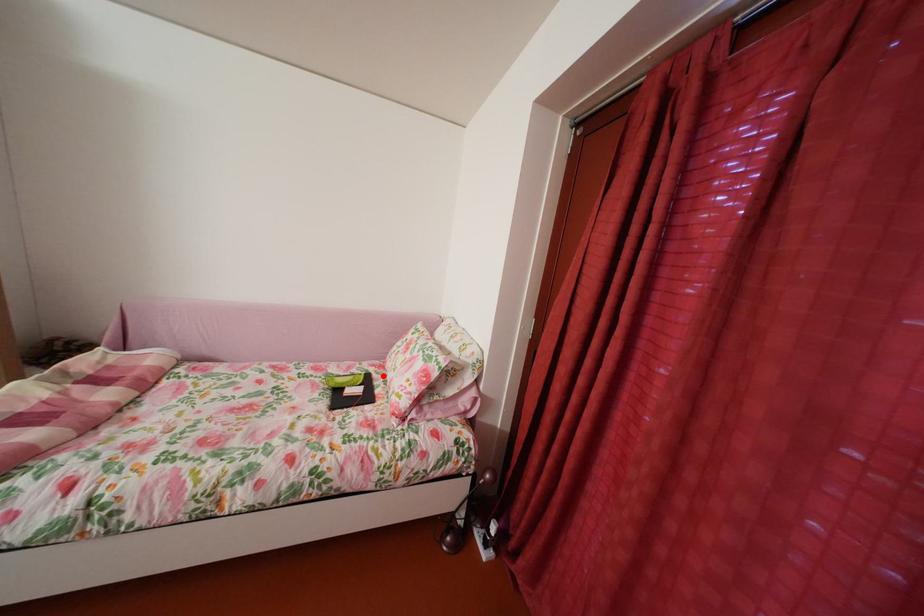
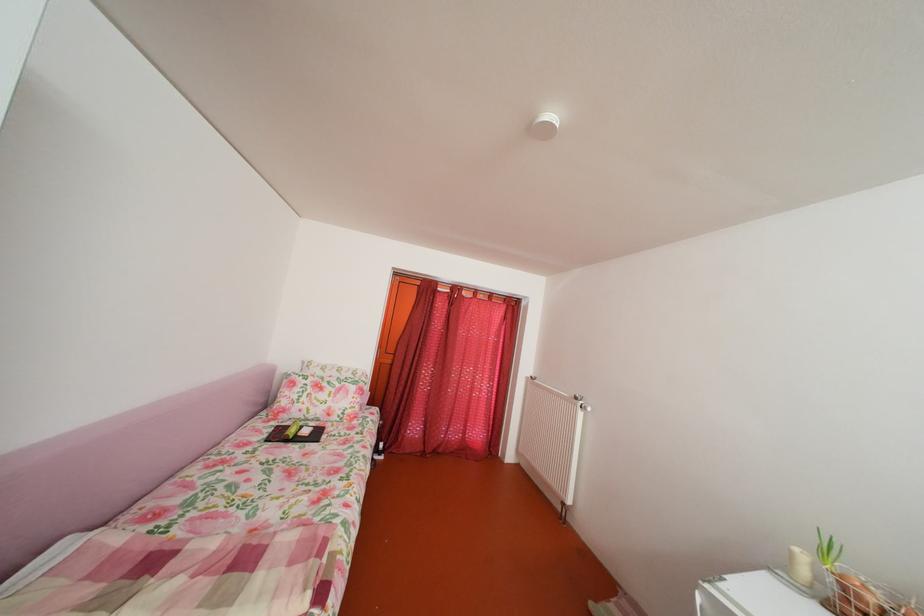
Question: I am providing you with two images of the same scene from different viewpoints. Given a red point in image1, look at the same physical point in image2. Is it:

Choices:
 (A) Closer to the viewpoint
 (B) Farther from the viewpoint

Answer: (A)